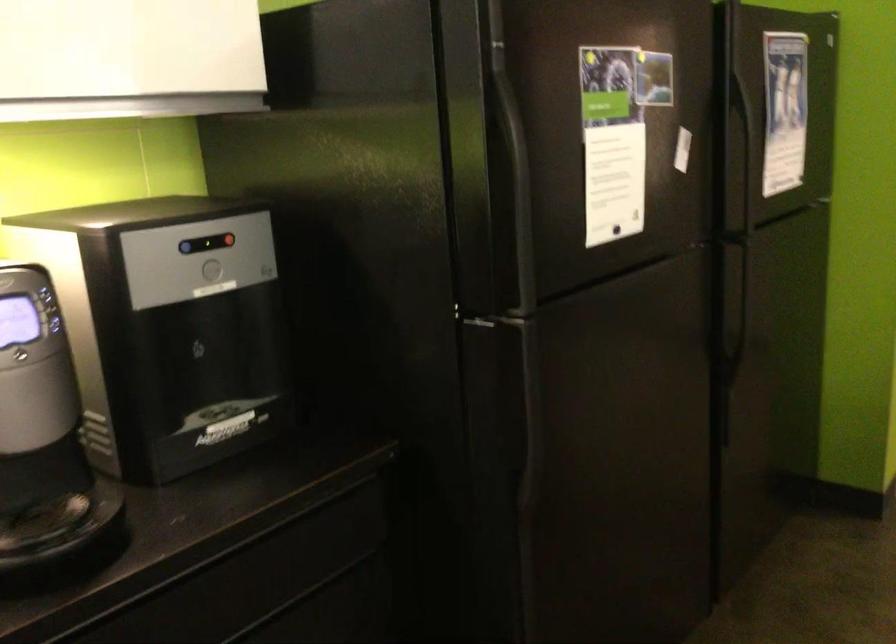
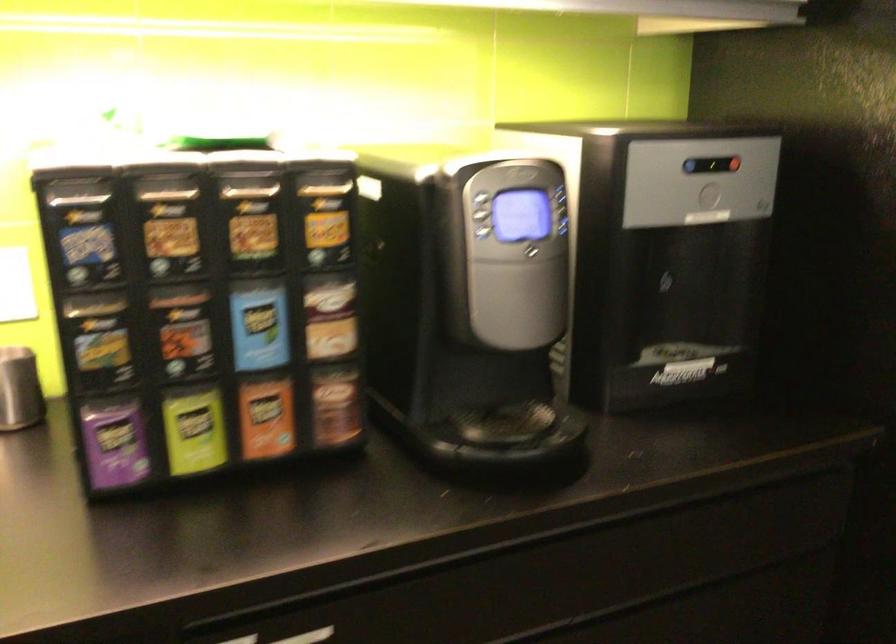
In the second image, find the point that corresponds to pixel 185 251 in the first image.

(691, 166)